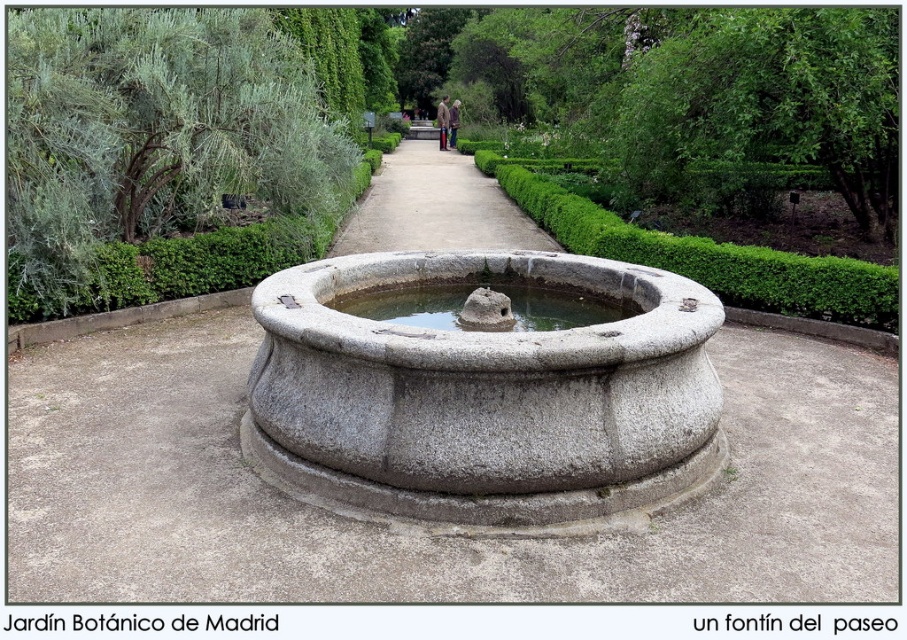
Who is positioned more to the left, green textured hedge at center or gray concrete path at center?

From the viewer's perspective, gray concrete path at center appears more on the left side.

Based on the photo, is green textured hedge at center bigger than gray concrete path at center?

Result: No.

Who is more distant from viewer, (x=802, y=284) or (x=525, y=243)?

Point (x=525, y=243)

I want to click on green textured hedge at center, so click(701, 252).

Where is `gray stone fountain at center`? The image size is (907, 640). gray stone fountain at center is located at coordinates (484, 397).

Does gray stone fountain at center have a greater width compared to clear stone water at center?

Yes.

Is point (454, 468) closer to camera compared to point (480, 284)?

Yes, it is.

The width and height of the screenshot is (907, 640). Identify the location of gray stone fountain at center. (484, 397).

Can you confirm if gray concrete path at center is smaller than clear stone water at center?

No, gray concrete path at center is not smaller than clear stone water at center.

Is point (421, 147) less distant than point (623, 310)?

No, it is not.

You are a GUI agent. You are given a task and a screenshot of the screen. Output one action in this format:
    pyautogui.click(x=<x>, y=<y>)
    Task: Click on the gray concrete path at center
    This screenshot has height=640, width=907.
    Given the screenshot: What is the action you would take?
    pyautogui.click(x=435, y=205)